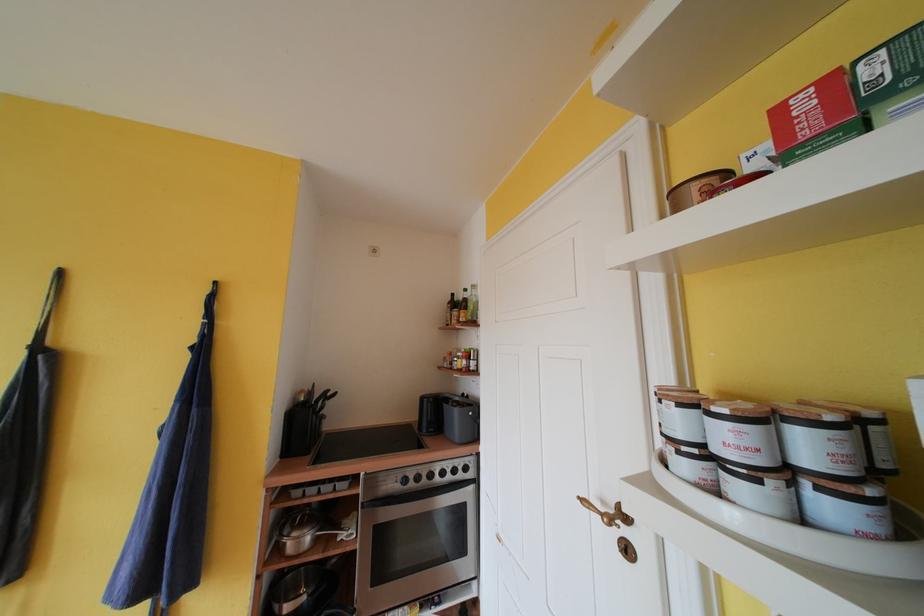
The width and height of the screenshot is (924, 616). Identify the location of brass door handle. (606, 513).